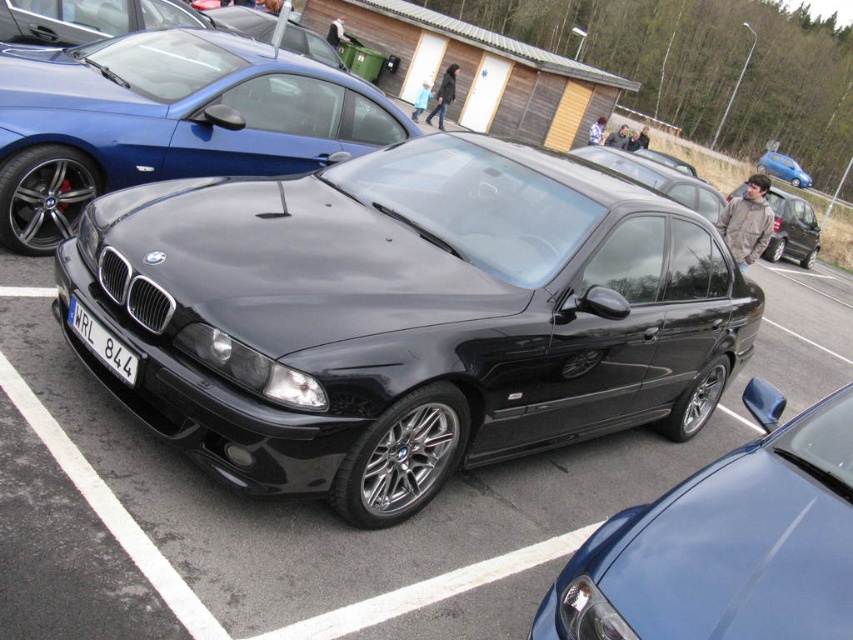
Question: Is the position of black matte sedan at center more distant than that of white plastic license plate at center?

Choices:
 (A) yes
 (B) no

Answer: (A)

Question: Which object appears closest to the camera in this image?

Choices:
 (A) glossy black car at center
 (B) metallic blue hatchback at upper right
 (C) black metallic car at center

Answer: (C)

Question: Is black matte sedan at center above white plastic license plate at center?

Choices:
 (A) yes
 (B) no

Answer: (A)

Question: Does white plastic license plate at center appear on the right side of metallic blue hatchback at upper right?

Choices:
 (A) yes
 (B) no

Answer: (B)

Question: Which object is farther from the camera taking this photo?

Choices:
 (A) white plastic license plate at center
 (B) black matte sedan at center
 (C) glossy blue car at center
 (D) black metallic car at center

Answer: (B)

Question: Which point is farther to the camera?

Choices:
 (A) (843, 541)
 (B) (810, 177)
 (C) (547, 291)
 (D) (64, 129)

Answer: (B)